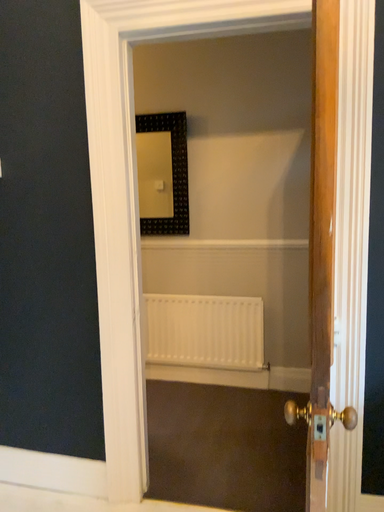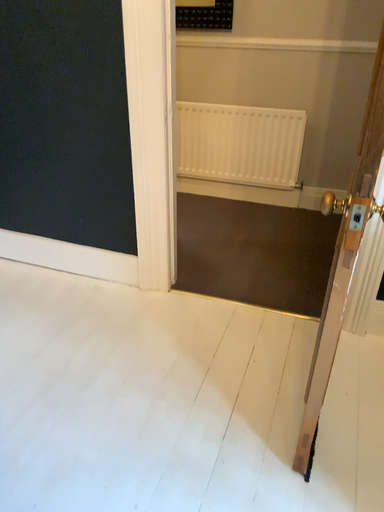
Question: Which way did the camera rotate in the video?

Choices:
 (A) rotated upward
 (B) rotated downward

Answer: (B)